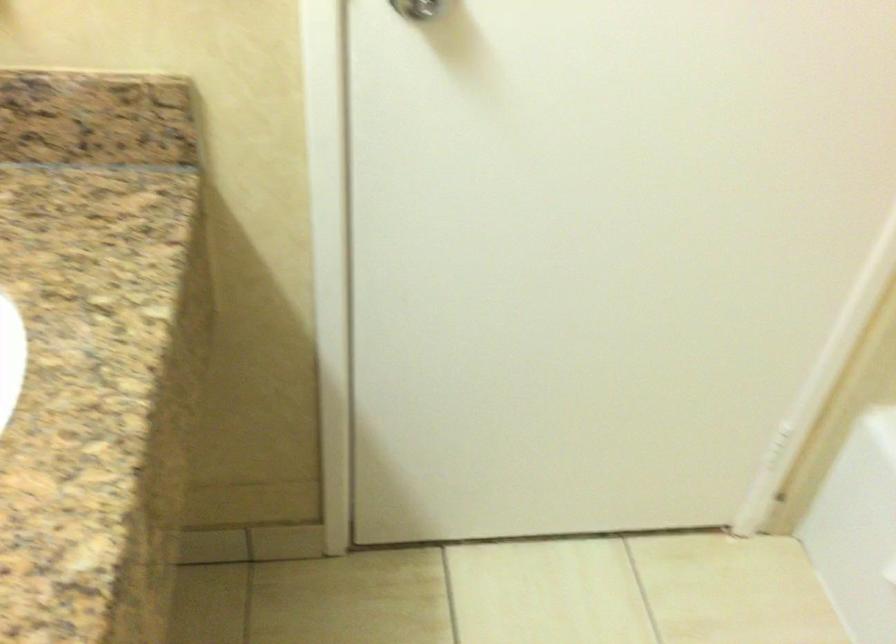
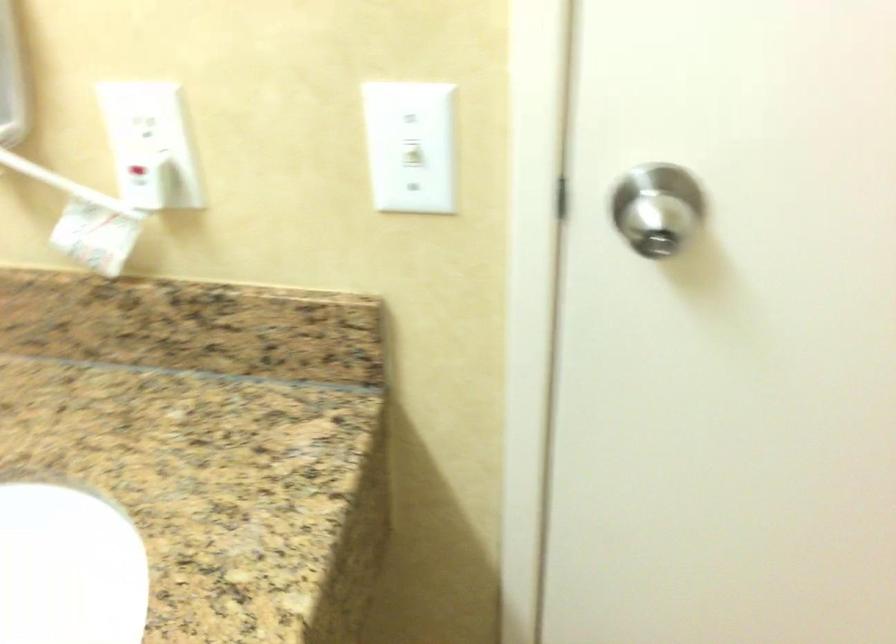
Question: Based on the continuous images, in which direction is the camera rotating? Reply with the corresponding letter.

Choices:
 (A) Left
 (B) Right
 (C) Up
 (D) Down

Answer: (A)